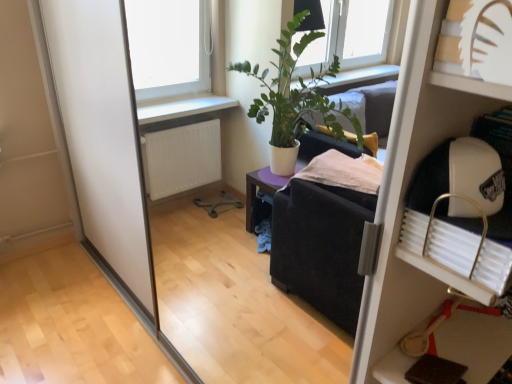
Question: Is point (x=434, y=284) positioned closer to the camera than point (x=472, y=82)?

Choices:
 (A) closer
 (B) farther

Answer: (B)

Question: Looking at their shapes, would you say white plastic shelf at upper right, the second shelf in the left-to-right sequence, is wider or thinner than white paper cutout at upper right, which is the 1th shelf in left-to-right order?

Choices:
 (A) wide
 (B) thin

Answer: (A)

Question: Is white plastic shelf at upper right, which ranks as the 1th shelf in back-to-front order, inside or outside of white paper cutout at upper right, which is the 1th shelf in left-to-right order?

Choices:
 (A) outside
 (B) inside

Answer: (A)

Question: Is white paper cutout at upper right, the 2th shelf when ordered from right to left, inside or outside of white plastic shelf at upper right, the second shelf in the left-to-right sequence?

Choices:
 (A) inside
 (B) outside

Answer: (A)

Question: Is point (490, 96) positioned closer to the camera than point (422, 294)?

Choices:
 (A) farther
 (B) closer

Answer: (B)

Question: Based on their positions, is white paper cutout at upper right, the 2th shelf when ordered from right to left, located to the left or right of white plastic shelf at upper right, which ranks as the 1th shelf in back-to-front order?

Choices:
 (A) right
 (B) left

Answer: (B)

Question: From a real-world perspective, is white paper cutout at upper right, the 1th shelf viewed from the front, physically located above or below white plastic shelf at upper right, acting as the first shelf starting from the right?

Choices:
 (A) below
 (B) above

Answer: (B)